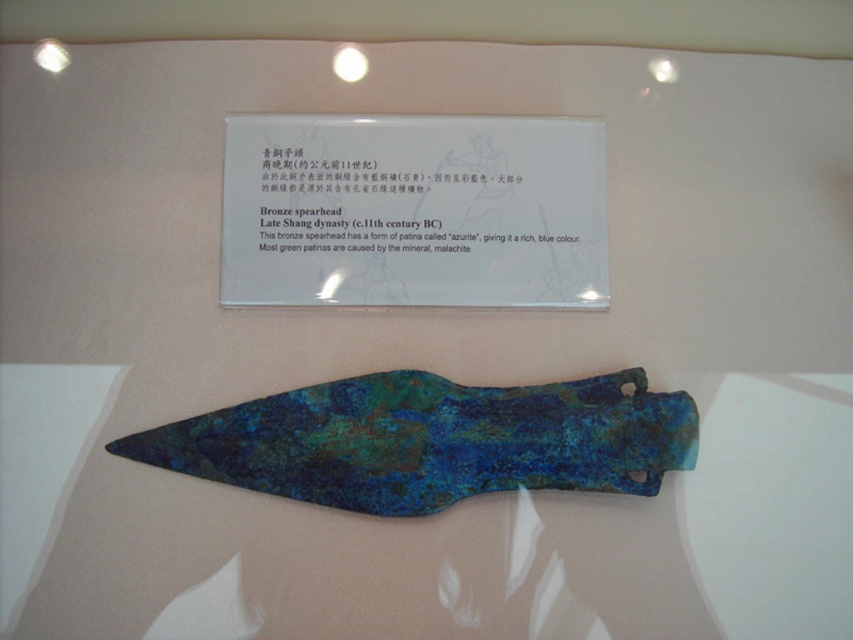
Which of these two, blue patina sign at upper center or blue-green patina spearhead at center, stands taller?

blue patina sign at upper center is taller.

Based on the photo, does blue patina sign at upper center come behind blue-green patina spearhead at center?

Yes, it is.

You are a GUI agent. You are given a task and a screenshot of the screen. Output one action in this format:
    pyautogui.click(x=<x>, y=<y>)
    Task: Click on the blue patina sign at upper center
    This screenshot has height=640, width=853.
    Given the screenshot: What is the action you would take?
    pyautogui.click(x=413, y=211)

You are a GUI agent. You are given a task and a screenshot of the screen. Output one action in this format:
    pyautogui.click(x=<x>, y=<y>)
    Task: Click on the blue patina sign at upper center
    The width and height of the screenshot is (853, 640).
    Given the screenshot: What is the action you would take?
    pyautogui.click(x=413, y=211)